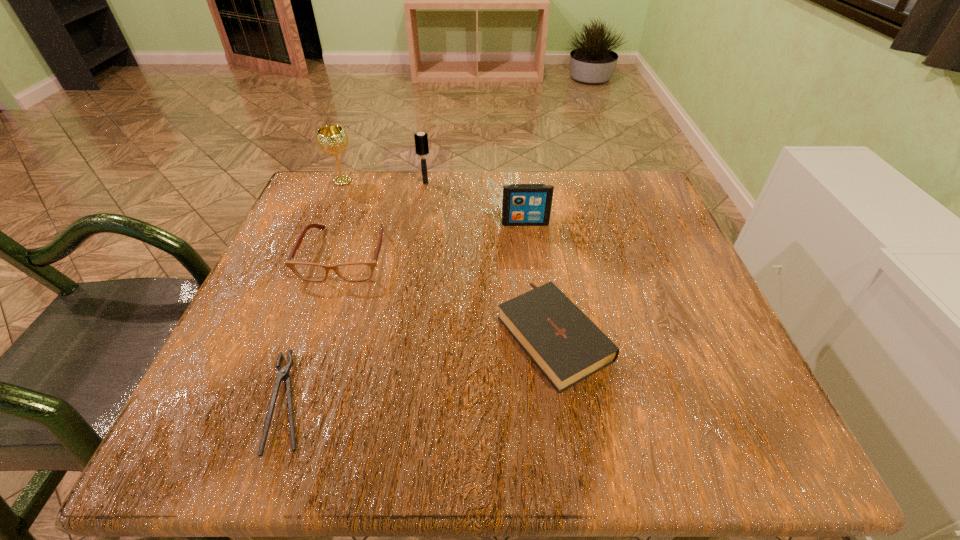
Identify the location of object that is the fourth closest to the fourth nearest object. This screenshot has width=960, height=540. (331, 139).

Select which object appears as the fifth closest to the fourth object from left to right. Please provide its 2D coordinates. Your answer should be formatted as a tuple, i.e. [(x, y)], where the tuple contains the x and y coordinates of a point satisfying the conditions above.

[(283, 374)]

Locate an element on the screen. Image resolution: width=960 pixels, height=540 pixels. vacant region that satisfies the following two spatial constraints: 1. on the front side of the hairbrush; 2. on the right side of the chalice is located at coordinates (342, 183).

Locate an element on the screen. The image size is (960, 540). free spot that satisfies the following two spatial constraints: 1. on the front screen of the Bible; 2. on the left side of the iPod is located at coordinates (539, 332).

Image resolution: width=960 pixels, height=540 pixels. I want to click on blank area in the image that satisfies the following two spatial constraints: 1. on the front screen of the fourth shortest object; 2. on the right side of the Bible, so click(539, 332).